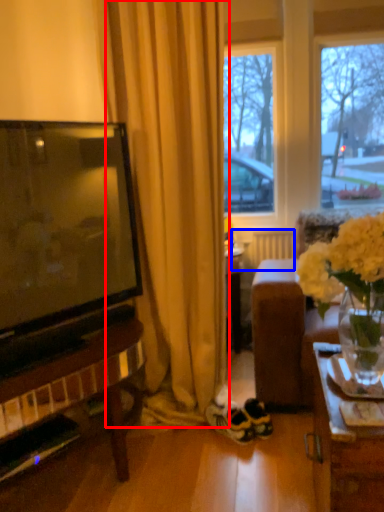
Question: Which of the following is the closest to the observer, curtain (highlighted by a red box) or radiator (highlighted by a blue box)?

Choices:
 (A) curtain
 (B) radiator

Answer: (A)